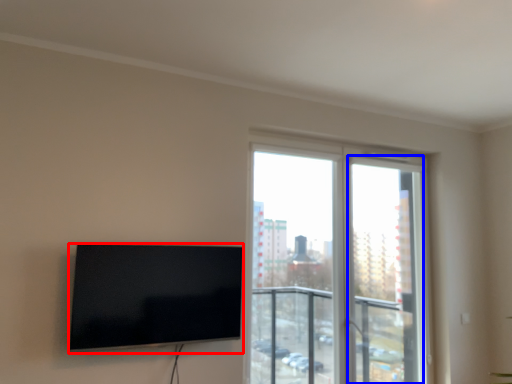
Question: Which point is closer to the camera, television (highlighted by a red box) or screen door (highlighted by a blue box)?

Choices:
 (A) television
 (B) screen door

Answer: (A)